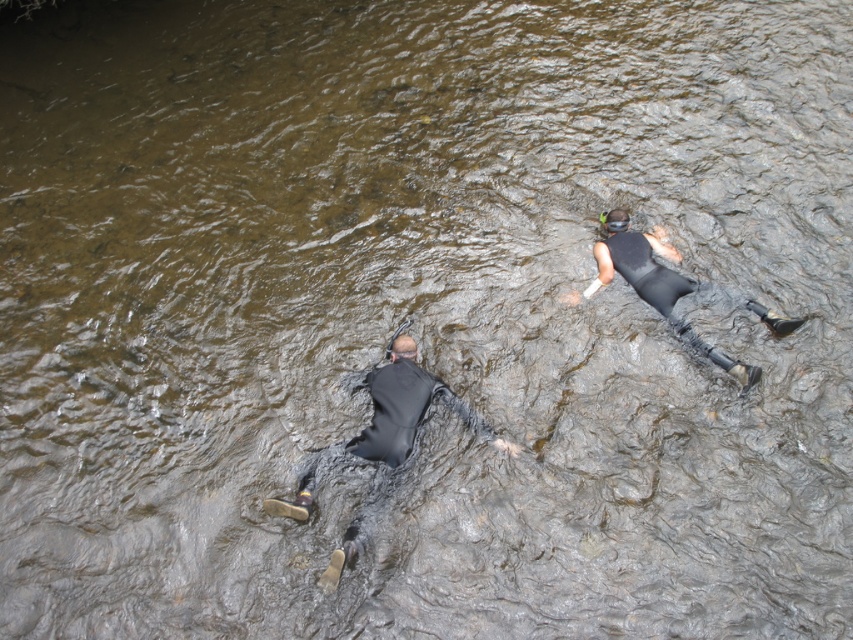
You are a lifeguard observing two people in the water. You notice the black matte wetsuit at lower left and the black matte wetsuit at upper right. Which wetsuit belongs to the larger individual?

The black matte wetsuit at lower left belongs to the larger individual because it is larger in size than the black matte wetsuit at upper right.

You are a lifeguard on duty and need to ensure safety gear is properly sized. You observe two individuals in the water wearing the black matte wetsuit at lower left and the black matte wetsuit at upper right. Which wetsuit has a larger width?

The black matte wetsuit at lower left has a larger width than the black matte wetsuit at upper right.

You are a safety inspector checking the positioning of equipment in the image. The black matte wetsuit at lower left is located at coordinates point 0.697, 0.447. Is this within the required safety zone defined as the rectangle from point 0.6 to point 0.7 on the x and y axes?

The black matte wetsuit at lower left is at point (380, 445). The safety zone is from 0.6 to 0.7 on both axes. Since 0.697 is between 0.6 and 0.7 for the x and y coordinates, it is within the required safety zone.